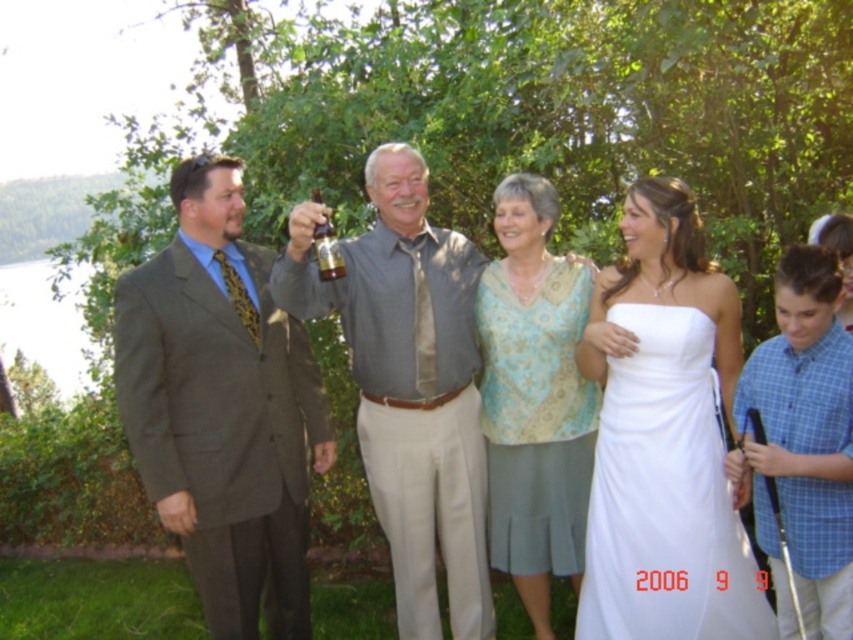
You are planning to seat two guests at a table that can only accommodate one person comfortably. The guests are wearing the matte brown suit at left and the white satin dress at right. Which guest should you seat first to ensure they have enough space?

You should seat the guest in the matte brown suit at left first because their suit is wider than the white satin dress at right, ensuring they have enough space.

You are a photographer at a wedding and need to position the matte gray suit at left and the gold glass bottle at center in your shot. Based on their positions, which object is closer to the right edge of the frame?

The matte gray suit at left is closer to the right edge of the frame because it is positioned to the right of the gold glass bottle at center.